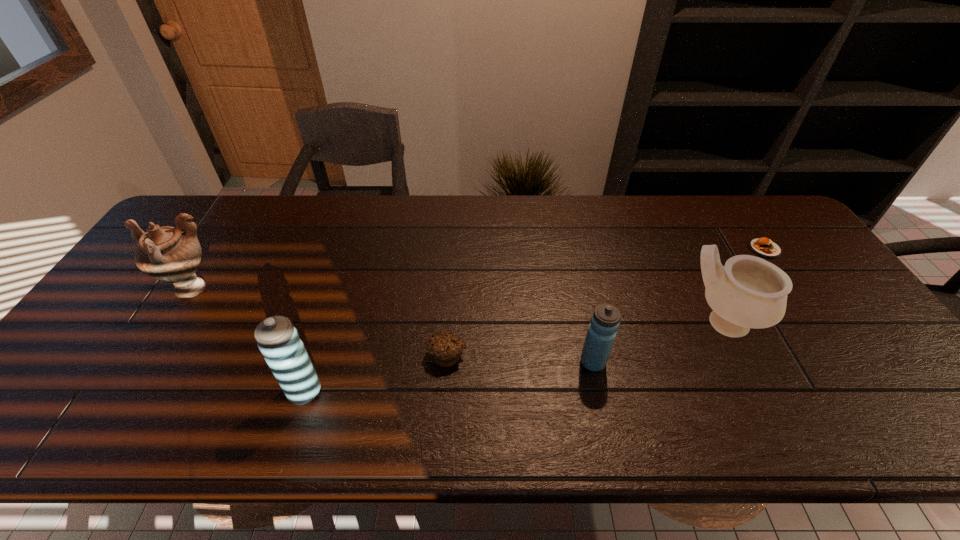
Locate an element on the screen. The image size is (960, 540). object positioned at the far right corner is located at coordinates (764, 247).

Find the location of `free region at the far edge`. free region at the far edge is located at coordinates (662, 212).

I want to click on vacant space at the near edge of the desktop, so click(x=689, y=373).

Locate an element on the screen. Image resolution: width=960 pixels, height=540 pixels. free region at the left edge of the desktop is located at coordinates (138, 307).

In the image, there is a desktop. Identify the location of vacant space at the right edge. This screenshot has height=540, width=960. (888, 357).

This screenshot has width=960, height=540. I want to click on free region at the far left corner of the desktop, so click(x=197, y=195).

This screenshot has width=960, height=540. In order to click on free region at the near right corner of the desktop in this screenshot , I will do `click(880, 388)`.

Locate an element on the screen. The image size is (960, 540). empty space that is in between the second object from left to right and the farthest object is located at coordinates (535, 320).

Where is `free space between the nearer water bottle and the fifth object from left to right`? Image resolution: width=960 pixels, height=540 pixels. free space between the nearer water bottle and the fifth object from left to right is located at coordinates (514, 357).

Identify the location of empty space that is in between the nearest object and the patty (food). This screenshot has height=540, width=960. (535, 320).